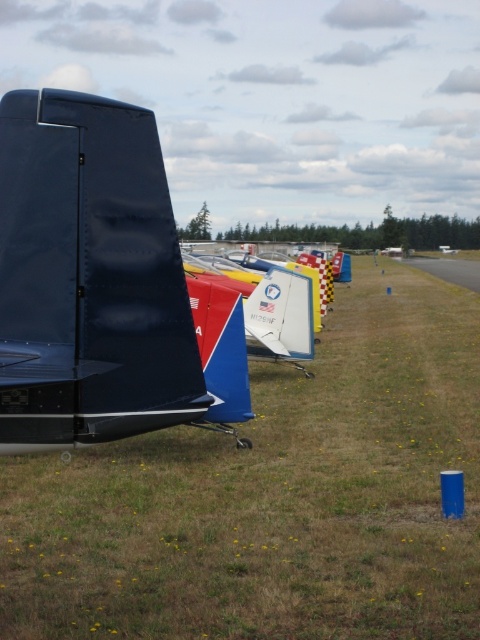
You are an airport maintenance worker who needs to park a new airplane that is 12 meters wide. You have two available spots between the matte black airplane at center and the metallic silver airplane at center. Can both spots accommodate the new airplane?

The matte black airplane at center is narrower than the metallic silver airplane at center. Since the new airplane is 12 meters wide, it can only fit in the spot between the metallic silver airplane at center and the next plane if that spot is wider than 12 meters. However, without knowing the exact width of the metallic silver airplane at center, we cannot confirm if the spot between it and the matte black airplane at center is sufficient. More information is needed to determine if both spots can fit the 1

You are a maintenance worker at the airfield and need to inspect both the matte black airplane at center and the metallic silver airplane at center. Based on their heights, which airplane requires a taller ladder for inspection?

The matte black airplane at center has a greater height compared to the metallic silver airplane at center, so it requires a taller ladder for inspection.

You are a pilot standing at the center of the airfield. You need to locate the matte black airplane at center. What are the coordinates where you should look?

The coordinates to locate the matte black airplane at center are at point (91, 280).